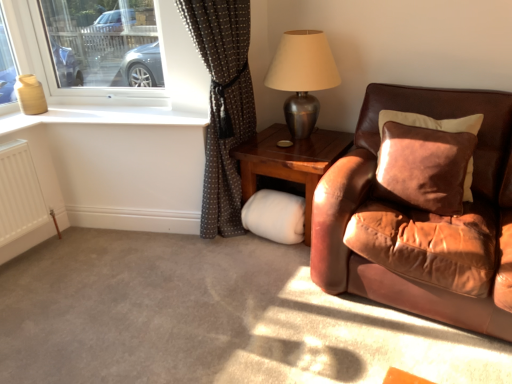
Question: Is point (305, 215) closer or farther from the camera than point (307, 54)?

Choices:
 (A) farther
 (B) closer

Answer: (A)

Question: Is wooden side table at right taller or shorter than metallic silver table lamp at upper right?

Choices:
 (A) tall
 (B) short

Answer: (B)

Question: Based on their relative distances, which object is farther from the metallic silver table lamp at upper right?

Choices:
 (A) clear glass window at upper left
 (B) brown dotted fabric at left
 (C) white matte radiator at lower left
 (D) suede brown pillow at right
 (E) wooden side table at right

Answer: (C)

Question: Estimate the real-world distances between objects in this image. Which object is closer to the clear glass window at upper left?

Choices:
 (A) suede brown pillow at right
 (B) brown leather couch at right
 (C) brown dotted fabric at left
 (D) metallic silver table lamp at upper right
 (E) white matte radiator at lower left

Answer: (C)